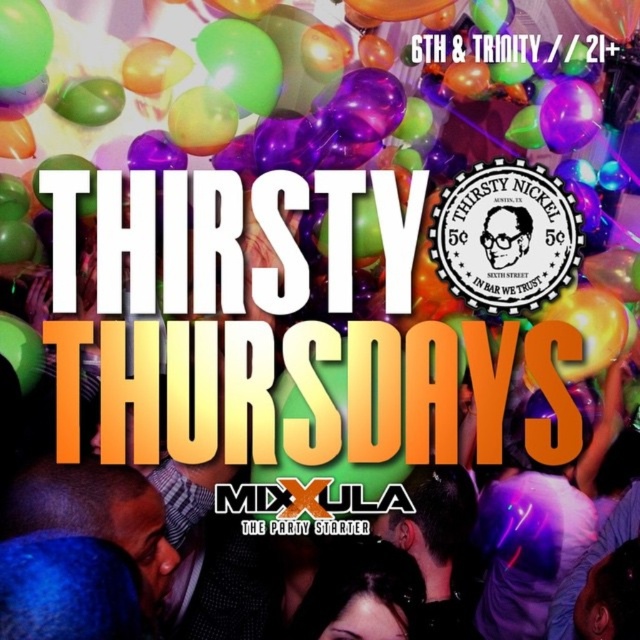
Can you confirm if blue fabric at lower left is positioned below matte black glasses at center?

Correct, blue fabric at lower left is located below matte black glasses at center.

At what (x,y) coordinates should I click in order to perform the action: click on blue fabric at lower left. Please return your answer as a coordinate pair (x, y). The height and width of the screenshot is (640, 640). Looking at the image, I should click on (97, 515).

Who is more forward, (138,508) or (349,544)?

Point (138,508) is more forward.

In the scene shown: Does blue fabric at lower left have a larger size compared to black hair at center?

Yes, blue fabric at lower left is bigger than black hair at center.

This screenshot has height=640, width=640. Identify the location of blue fabric at lower left. (97, 515).

Can you confirm if black hair at center is bigger than matte black glasses at center?

Yes, black hair at center is bigger than matte black glasses at center.

Can you confirm if black hair at center is thinner than matte black glasses at center?

Incorrect, black hair at center's width is not less than matte black glasses at center's.

This screenshot has width=640, height=640. Describe the element at coordinates (362, 595) in the screenshot. I see `black hair at center` at that location.

I want to click on black hair at center, so click(x=362, y=595).